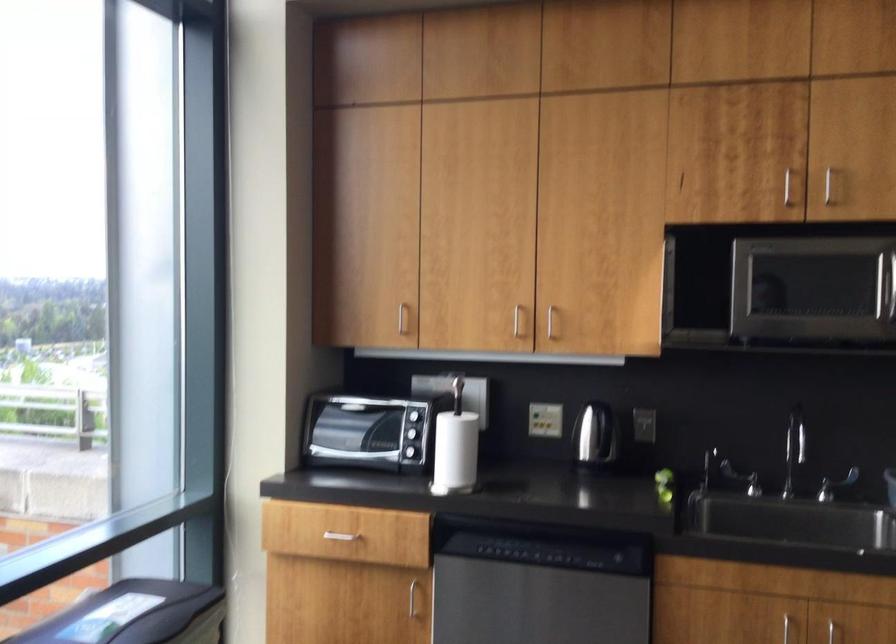
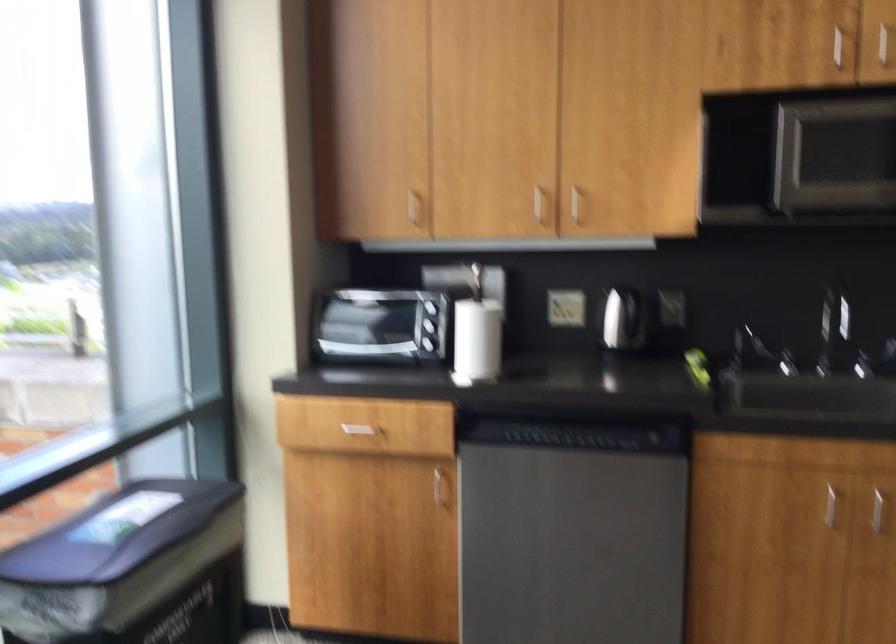
Consider the image. The images are taken continuously from a first-person perspective. In which direction are you moving?

The movement direction of the cameraman is left, forward.